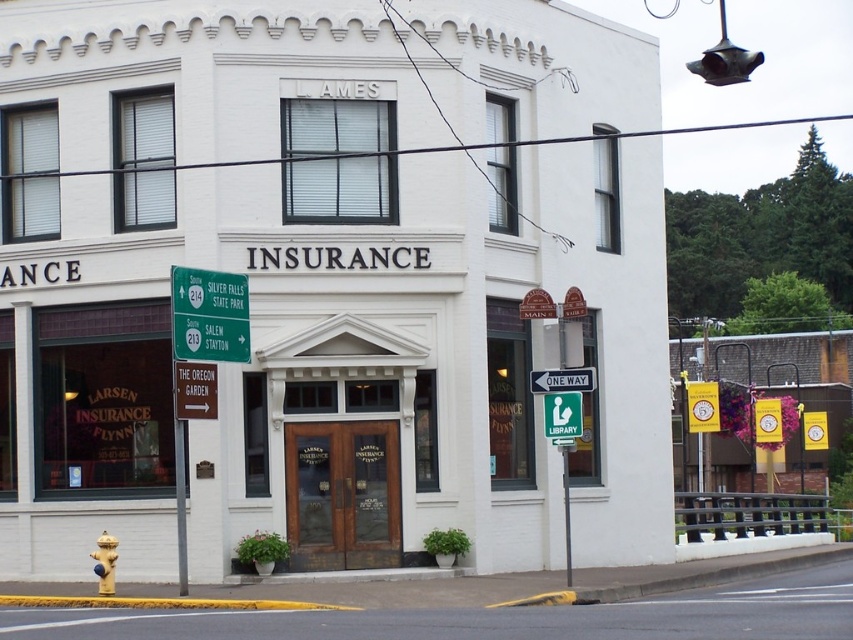
Question: Which of these objects is positioned farthest from the green plastic street sign at lower right?

Choices:
 (A) metallic pole at lower left
 (B) metallic pole at center

Answer: (A)

Question: Which point is closer to the camera taking this photo?

Choices:
 (A) [x=566, y=452]
 (B) [x=177, y=540]

Answer: (B)

Question: Is metallic pole at lower left above green plastic street sign at lower right?

Choices:
 (A) yes
 (B) no

Answer: (B)

Question: Can you confirm if white brick building at center is wider than metallic pole at center?

Choices:
 (A) no
 (B) yes

Answer: (B)

Question: Does metallic pole at lower left appear on the right side of metallic pole at center?

Choices:
 (A) yes
 (B) no

Answer: (B)

Question: Which of the following is the farthest from the observer?

Choices:
 (A) green plastic street sign at lower right
 (B) metallic pole at lower left

Answer: (A)